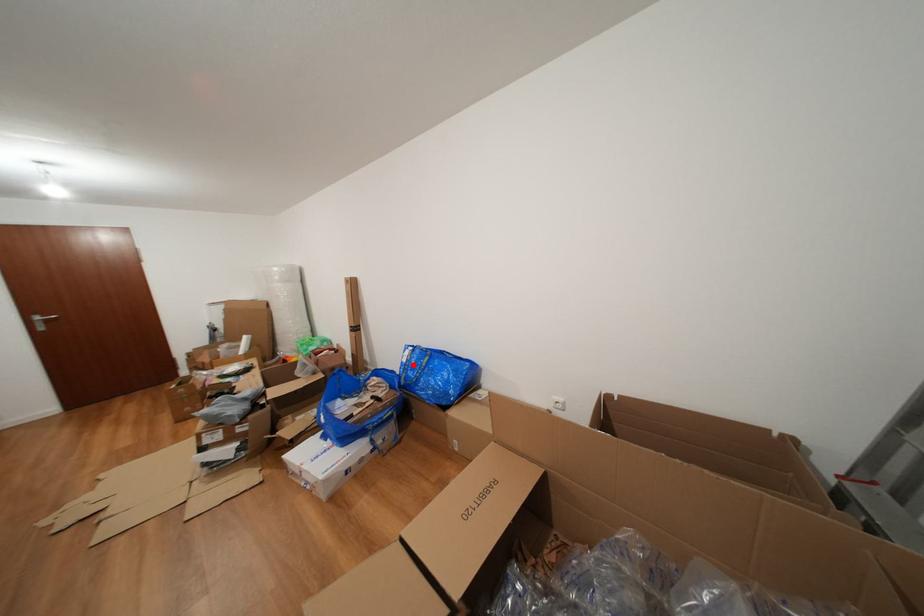
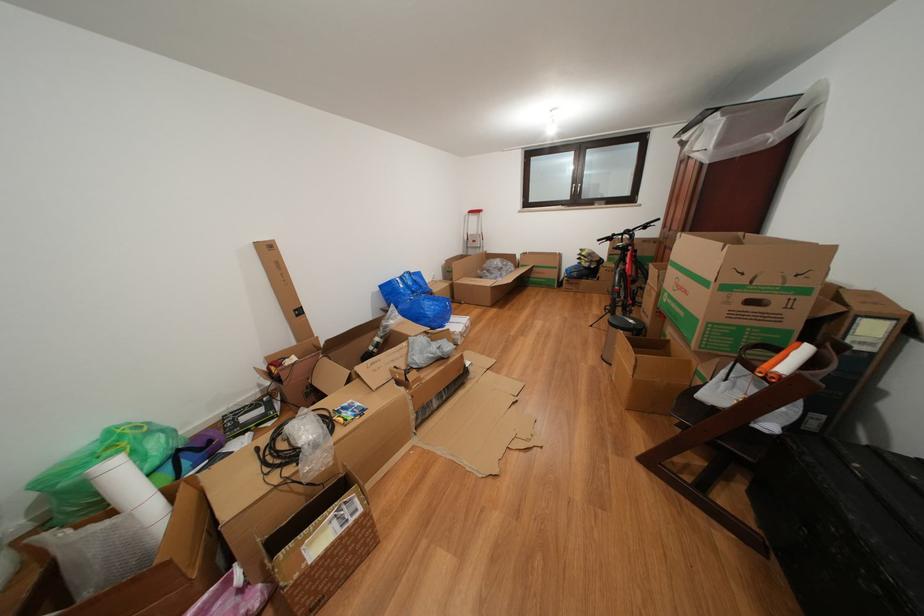
Question: I am providing you with two images of the same scene from different viewpoints. Given a red point in image1, look at the same physical point in image2. Is it:

Choices:
 (A) Closer to the viewpoint
 (B) Farther from the viewpoint

Answer: (A)